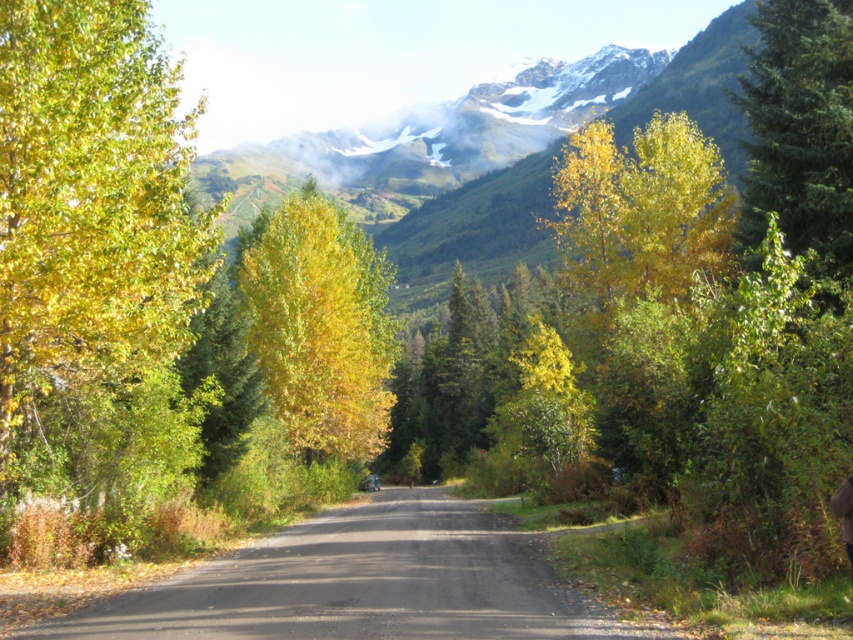
Question: Does yellow matte tree at center have a smaller size compared to green evergreen tree at right?

Choices:
 (A) yes
 (B) no

Answer: (B)

Question: In this image, where is yellow-green leaves at left located relative to green evergreen tree at right?

Choices:
 (A) below
 (B) above

Answer: (A)

Question: Considering the real-world distances, which object is farthest from the yellow-green leaves at left?

Choices:
 (A) asphalt road at center
 (B) green evergreen tree at right
 (C) yellow matte tree at center
 (D) brown leather jacket at center

Answer: (C)

Question: Observing the image, what is the correct spatial positioning of yellow matte tree at center in reference to brown leather jacket at center?

Choices:
 (A) above
 (B) below

Answer: (A)

Question: Which point is closer to the camera taking this photo?

Choices:
 (A) (834, 496)
 (B) (433, 490)

Answer: (A)

Question: Which object is positioned closest to the yellow matte tree at center?

Choices:
 (A) yellow-green leaves at left
 (B) asphalt road at center
 (C) green evergreen tree at right
 (D) brown leather jacket at center

Answer: (B)